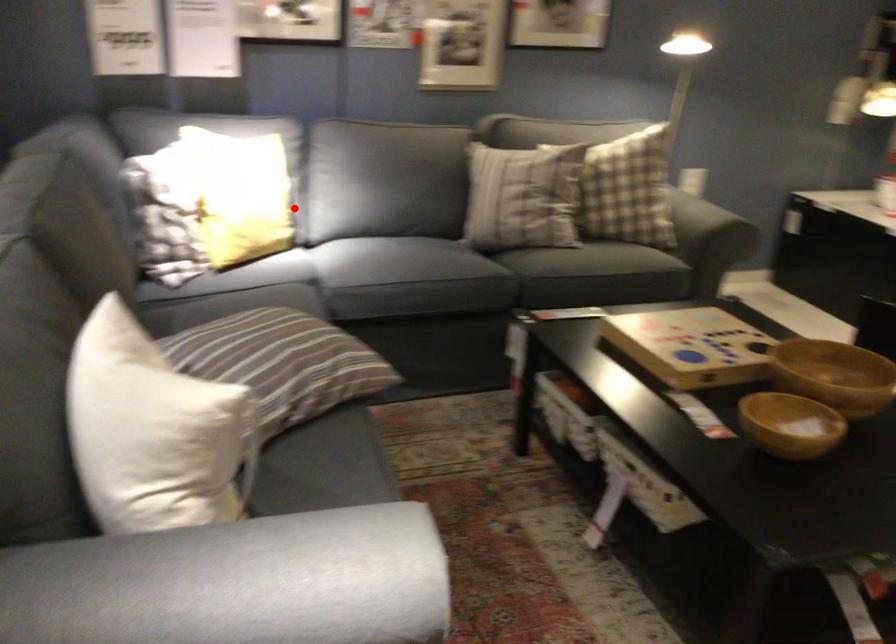
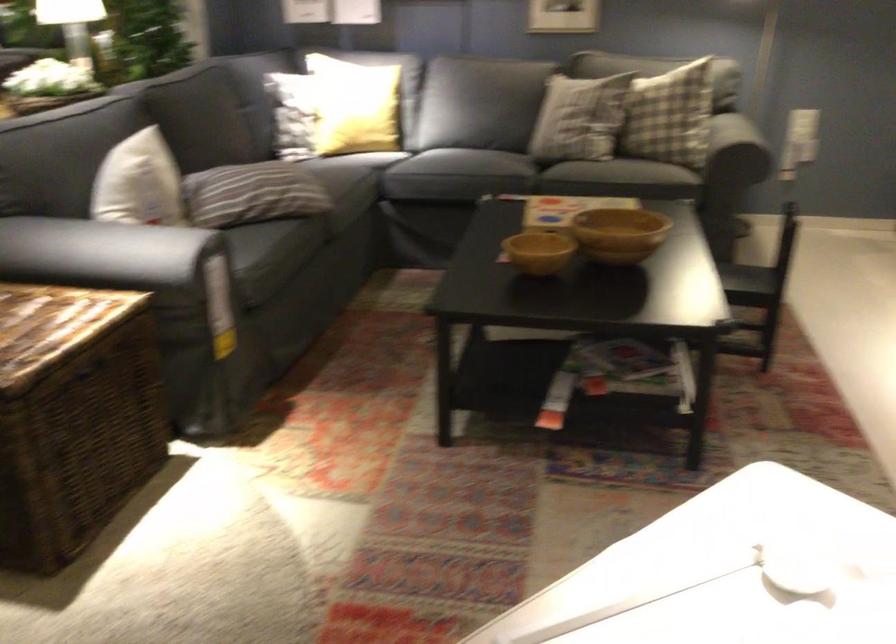
Question: I am providing you with two images of the same scene from different viewpoints. Given a red point in image1, look at the same physical point in image2. Is it:

Choices:
 (A) Closer to the viewpoint
 (B) Farther from the viewpoint

Answer: (B)